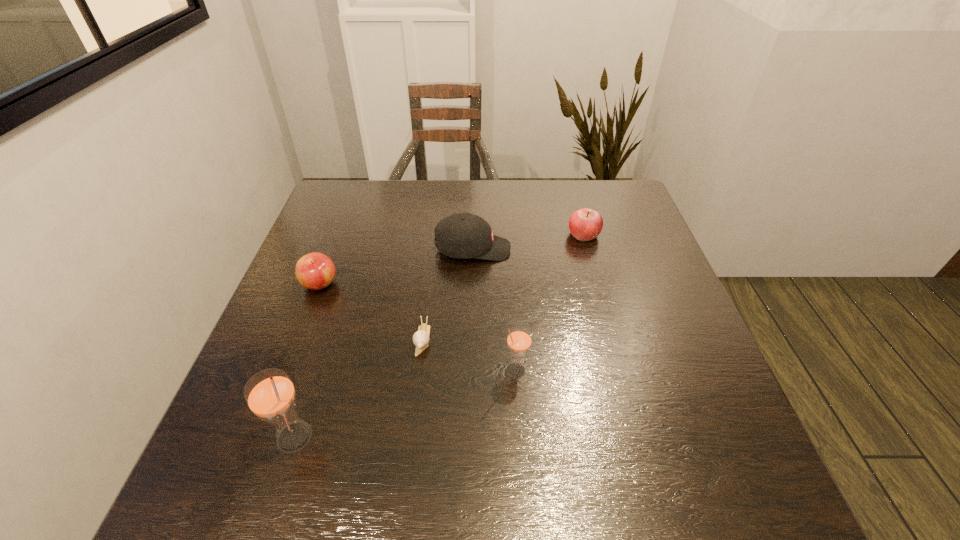
Please point a vacant point for placing a straw on the right. Please provide its 2D coordinates. Your answer should be formatted as a tuple, i.e. [(x, y)], where the tuple contains the x and y coordinates of a point satisfying the conditions above.

[(690, 315)]